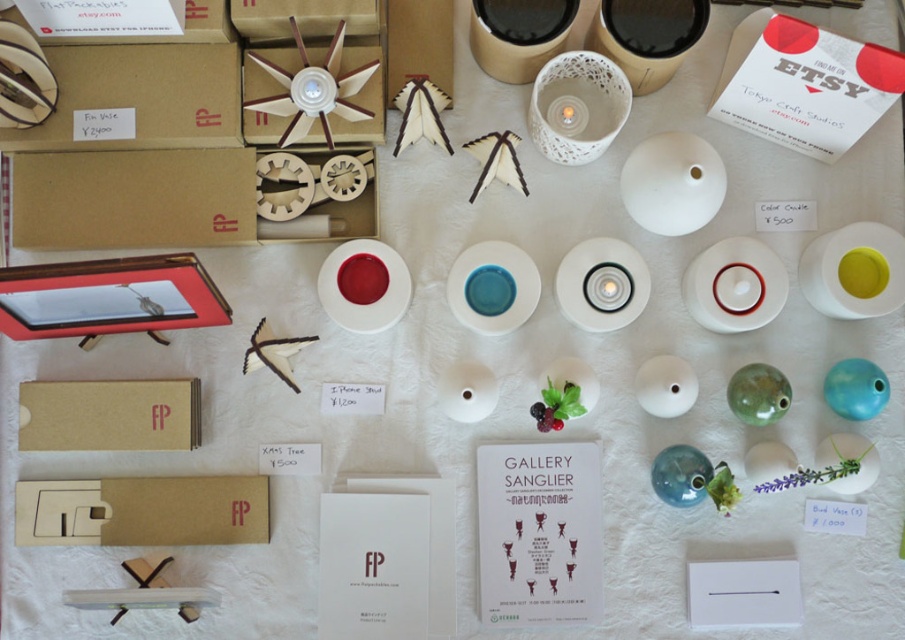
Who is shorter, translucent white plate at center or blue glossy plate at center?

translucent white plate at center

Is point (610, 314) in front of point (484, 291)?

Yes, point (610, 314) is closer to viewer.

Where is `translucent white plate at center`? translucent white plate at center is located at coordinates (601, 284).

Can you confirm if matte cardboard box at upper left is thinner than matte white plate at center?

In fact, matte cardboard box at upper left might be wider than matte white plate at center.

Between matte cardboard box at upper left and matte white plate at center, which one is positioned lower?

Positioned lower is matte white plate at center.

You are a GUI agent. You are given a task and a screenshot of the screen. Output one action in this format:
    pyautogui.click(x=<x>, y=<y>)
    Task: Click on the matte cardboard box at upper left
    The width and height of the screenshot is (905, 640).
    Given the screenshot: What is the action you would take?
    pyautogui.click(x=139, y=97)

Find the location of a particular element. This screenshot has width=905, height=640. matte cardboard box at upper left is located at coordinates (139, 97).

Can you confirm if white matte plate at center is wider than matte white plate at center?

Yes.

Is white matte plate at center thinner than matte white plate at center?

In fact, white matte plate at center might be wider than matte white plate at center.

Does point (644, 200) come behind point (335, 304)?

That is False.

Where is `white matte plate at center`? Image resolution: width=905 pixels, height=640 pixels. white matte plate at center is located at coordinates (672, 182).